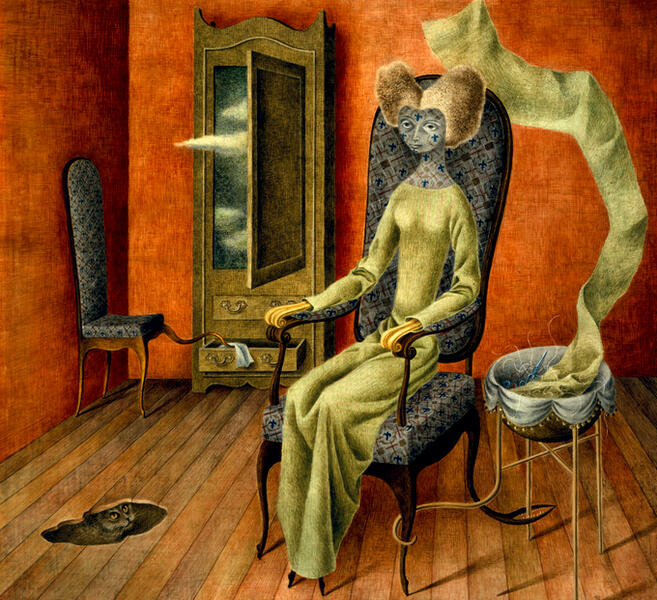
At what (x,y) coordinates should I click in order to perform the action: click on floor. Please return your answer as a coordinate pair (x, y). Looking at the image, I should click on (211, 548).